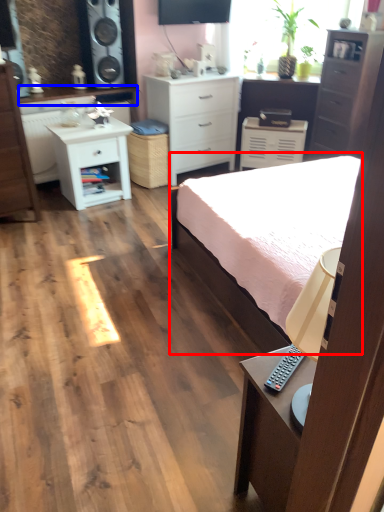
Question: Which of the following is the closest to the observer, bed (highlighted by a red box) or counter top (highlighted by a blue box)?

Choices:
 (A) bed
 (B) counter top

Answer: (A)